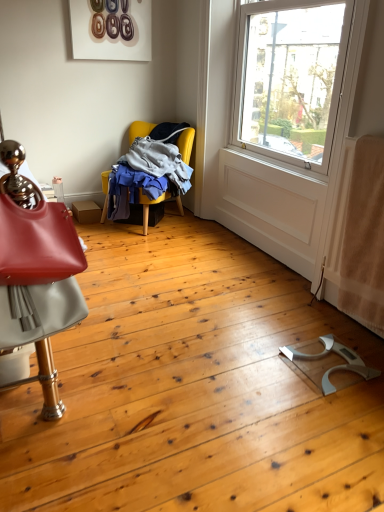
Describe the element at coordinates (39, 283) in the screenshot. The image size is (384, 512). I see `matte red chair at left, positioned as the first chair in bottom-to-top order` at that location.

The height and width of the screenshot is (512, 384). Find the location of `matte red chair at left, placed as the 2th chair when sorted from top to bottom`. matte red chair at left, placed as the 2th chair when sorted from top to bottom is located at coordinates (39, 283).

What is the approximate width of matte red chair at left, positioned as the first chair in bottom-to-top order?

It is 10.79 inches.

Measure the distance between yellow fabric chair at upper left, marked as the first chair in a top-to-bottom arrangement, and camera.

The distance of yellow fabric chair at upper left, marked as the first chair in a top-to-bottom arrangement, from camera is 3.18 meters.

Describe the element at coordinates (186, 143) in the screenshot. I see `yellow fabric chair at upper left, the second chair viewed from the front` at that location.

This screenshot has width=384, height=512. In order to click on yellow fabric chair at upper left, marked as the first chair in a top-to-bottom arrangement in this screenshot , I will do `click(186, 143)`.

The height and width of the screenshot is (512, 384). In order to click on matte red chair at left, placed as the 2th chair when sorted from top to bottom in this screenshot , I will do `click(39, 283)`.

Considering the relative positions of yellow fabric chair at upper left, the second chair ordered from the bottom, and matte red chair at left, placed as the 2th chair when sorted from top to bottom, in the image provided, is yellow fabric chair at upper left, the second chair ordered from the bottom, to the left of matte red chair at left, placed as the 2th chair when sorted from top to bottom, from the viewer's perspective?

In fact, yellow fabric chair at upper left, the second chair ordered from the bottom, is to the right of matte red chair at left, placed as the 2th chair when sorted from top to bottom.

Is yellow fabric chair at upper left, the second chair ordered from the bottom, further to camera compared to matte red chair at left, which is the first chair in front-to-back order?

Yes.

Does point (160, 200) lie behind point (50, 209)?

Yes, it is behind point (50, 209).

From the image's perspective, is yellow fabric chair at upper left, the second chair ordered from the bottom, located above or below matte red chair at left, positioned as the first chair in bottom-to-top order?

Based on their image positions, yellow fabric chair at upper left, the second chair ordered from the bottom, is located above matte red chair at left, positioned as the first chair in bottom-to-top order.

From a real-world perspective, which object stands above the other?

matte red chair at left, positioned as the first chair in bottom-to-top order, is physically above.

Which of these two, yellow fabric chair at upper left, positioned as the first chair in back-to-front order, or matte red chair at left, which is counted as the second chair, starting from the back, is thinner?

matte red chair at left, which is counted as the second chair, starting from the back, is thinner.

Considering the sizes of objects yellow fabric chair at upper left, marked as the first chair in a top-to-bottom arrangement, and matte red chair at left, placed as the 2th chair when sorted from top to bottom, in the image provided, who is taller, yellow fabric chair at upper left, marked as the first chair in a top-to-bottom arrangement, or matte red chair at left, placed as the 2th chair when sorted from top to bottom,?

With more height is yellow fabric chair at upper left, marked as the first chair in a top-to-bottom arrangement.

Consider the image. Is yellow fabric chair at upper left, positioned as the first chair in back-to-front order, bigger than matte red chair at left, placed as the 2th chair when sorted from top to bottom?

Yes, yellow fabric chair at upper left, positioned as the first chair in back-to-front order, is bigger than matte red chair at left, placed as the 2th chair when sorted from top to bottom.

Is yellow fabric chair at upper left, marked as the first chair in a top-to-bottom arrangement, positioned beyond the bounds of matte red chair at left, which is counted as the second chair, starting from the back?

That's correct, yellow fabric chair at upper left, marked as the first chair in a top-to-bottom arrangement, is outside of matte red chair at left, which is counted as the second chair, starting from the back.

Is the surface of yellow fabric chair at upper left, the second chair viewed from the front, in direct contact with matte red chair at left, which is the first chair in front-to-back order?

No, yellow fabric chair at upper left, the second chair viewed from the front, is not beside matte red chair at left, which is the first chair in front-to-back order.

Could you tell me if yellow fabric chair at upper left, the second chair ordered from the bottom, is facing matte red chair at left, which is counted as the second chair, starting from the back?

Yes, yellow fabric chair at upper left, the second chair ordered from the bottom, is oriented towards matte red chair at left, which is counted as the second chair, starting from the back.

How different are the orientations of yellow fabric chair at upper left, positioned as the first chair in back-to-front order, and matte red chair at left, placed as the 2th chair when sorted from top to bottom, in degrees?

There is a 59.4-degree angle between the facing directions of yellow fabric chair at upper left, positioned as the first chair in back-to-front order, and matte red chair at left, placed as the 2th chair when sorted from top to bottom.

Measure the distance from yellow fabric chair at upper left, marked as the first chair in a top-to-bottom arrangement, to matte red chair at left, which is counted as the second chair, starting from the back.

yellow fabric chair at upper left, marked as the first chair in a top-to-bottom arrangement, is 2.18 meters from matte red chair at left, which is counted as the second chair, starting from the back.

At what (x,y) coordinates should I click in order to perform the action: click on chair that is above the matte red chair at left, placed as the 2th chair when sorted from top to bottom (from the image's perspective). Please return your answer as a coordinate pair (x, y). The image size is (384, 512). Looking at the image, I should click on (186, 143).

Which is more to the left, matte red chair at left, which is counted as the second chair, starting from the back, or yellow fabric chair at upper left, the second chair ordered from the bottom?

From the viewer's perspective, matte red chair at left, which is counted as the second chair, starting from the back, appears more on the left side.

Does matte red chair at left, which is counted as the second chair, starting from the back, lie behind yellow fabric chair at upper left, the second chair ordered from the bottom?

No, matte red chair at left, which is counted as the second chair, starting from the back, is closer to the viewer.

Does point (26, 291) lie in front of point (105, 191)?

Yes, it is.

From the image's perspective, is matte red chair at left, positioned as the first chair in bottom-to-top order, above yellow fabric chair at upper left, the second chair viewed from the front?

No, from the image's perspective, matte red chair at left, positioned as the first chair in bottom-to-top order, is not above yellow fabric chair at upper left, the second chair viewed from the front.

From a real-world perspective, is matte red chair at left, which is counted as the second chair, starting from the back, physically located above or below yellow fabric chair at upper left, the second chair ordered from the bottom?

matte red chair at left, which is counted as the second chair, starting from the back, is above yellow fabric chair at upper left, the second chair ordered from the bottom.

Between matte red chair at left, which is the first chair in front-to-back order, and yellow fabric chair at upper left, marked as the first chair in a top-to-bottom arrangement, which one has smaller width?

matte red chair at left, which is the first chair in front-to-back order, is thinner.

Does matte red chair at left, placed as the 2th chair when sorted from top to bottom, have a lesser height compared to yellow fabric chair at upper left, the second chair ordered from the bottom?

Yes.

Is matte red chair at left, which is counted as the second chair, starting from the back, bigger than yellow fabric chair at upper left, marked as the first chair in a top-to-bottom arrangement?

Actually, matte red chair at left, which is counted as the second chair, starting from the back, might be smaller than yellow fabric chair at upper left, marked as the first chair in a top-to-bottom arrangement.

Is yellow fabric chair at upper left, the second chair viewed from the front, surrounded by matte red chair at left, positioned as the first chair in bottom-to-top order?

No, yellow fabric chair at upper left, the second chair viewed from the front, is not inside matte red chair at left, positioned as the first chair in bottom-to-top order.

Is matte red chair at left, which is counted as the second chair, starting from the back, directly adjacent to yellow fabric chair at upper left, positioned as the first chair in back-to-front order?

There is a gap between matte red chair at left, which is counted as the second chair, starting from the back, and yellow fabric chair at upper left, positioned as the first chair in back-to-front order.

Is matte red chair at left, which is the first chair in front-to-back order, looking in the opposite direction of yellow fabric chair at upper left, the second chair viewed from the front?

No.

Can you tell me how much matte red chair at left, which is the first chair in front-to-back order, and yellow fabric chair at upper left, the second chair viewed from the front, differ in facing direction?

The angle between the facing direction of matte red chair at left, which is the first chair in front-to-back order, and the facing direction of yellow fabric chair at upper left, the second chair viewed from the front, is 59.4 degrees.

Where is `chair that is on the left side of yellow fabric chair at upper left, the second chair ordered from the bottom`? chair that is on the left side of yellow fabric chair at upper left, the second chair ordered from the bottom is located at coordinates (39, 283).

This screenshot has width=384, height=512. In order to click on chair above the yellow fabric chair at upper left, the second chair viewed from the front (from a real-world perspective) in this screenshot , I will do `click(39, 283)`.

Identify the location of chair above the matte red chair at left, which is the first chair in front-to-back order (from the image's perspective). pos(186,143).